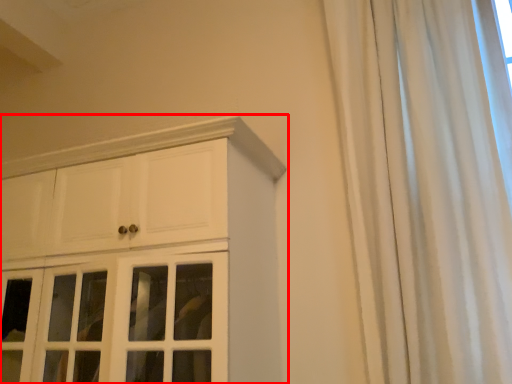
Question: From the image's perspective, where is cupboard (annotated by the red box) located in relation to curtain in the image?

Choices:
 (A) above
 (B) below

Answer: (B)